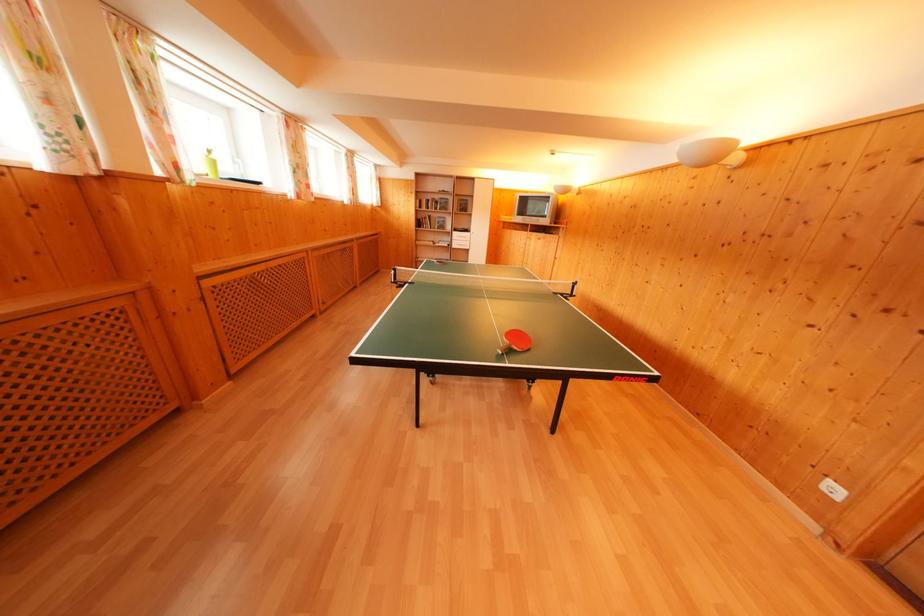
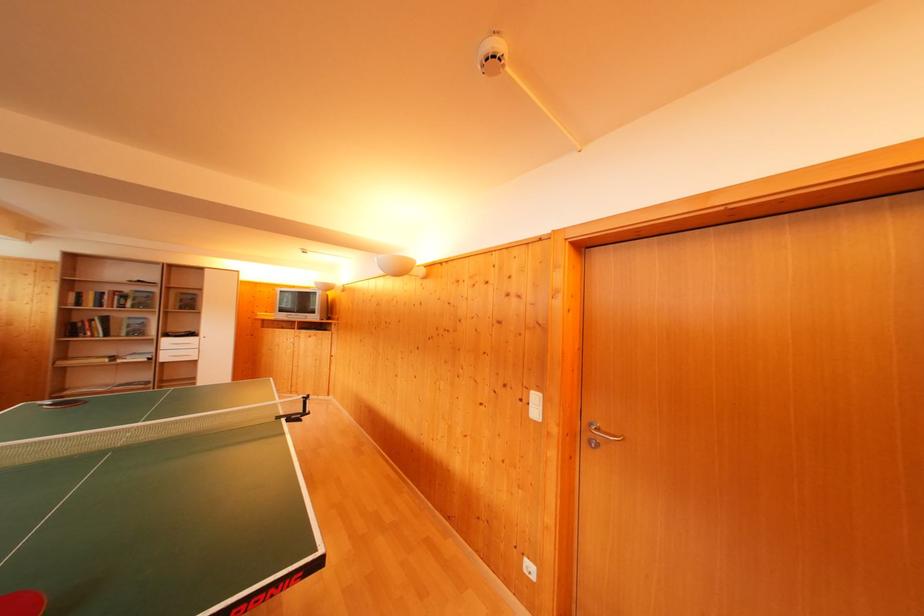
Find the pixel in the second image that matches (x=434, y=203) in the first image.

(112, 294)